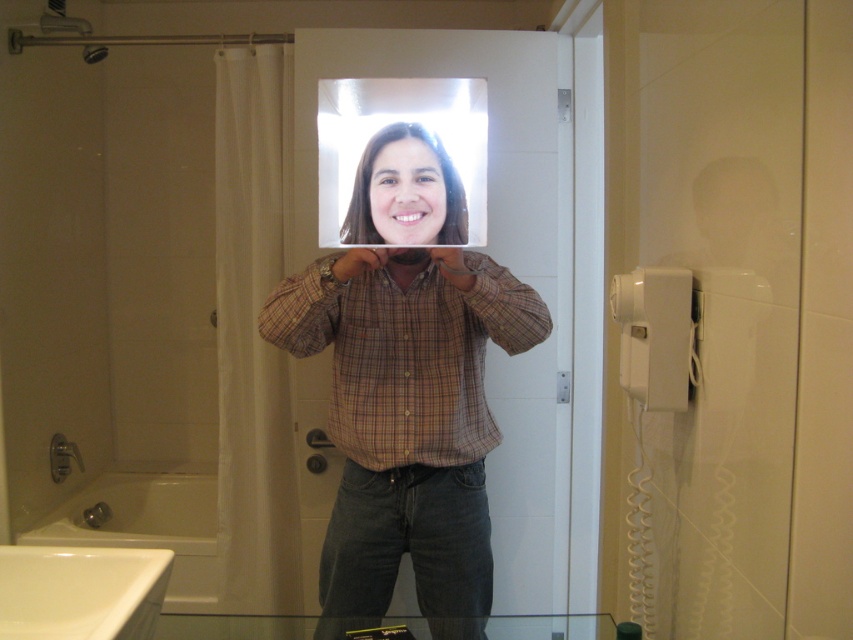
You are holding a matte plastic tablet at center and a clear plastic mirror at center in your hands. You want to place them on a shelf that is 30 centimeters wide. Can both items fit side by side on the shelf without overlapping?

The distance between the matte plastic tablet at center and the clear plastic mirror at center is 22.17 centimeters. Since the shelf is 30 centimeters wide, which is wider than the combined width of both items, they can fit side by side without overlapping.

You are trying to decide which item to place on a small shelf that can only hold items up to the size of the clear plastic mirror at center. Can you place the matte plastic tablet at center on the shelf?

The matte plastic tablet at center is larger in size than the clear plastic mirror at center. Therefore, the matte plastic tablet at center cannot be placed on the shelf since it exceeds the size limit.

You are trying to read a message on the matte plastic tablet at center while holding the clear plastic mirror at center in front of your face. Can you see the tablet clearly through the mirror?

The matte plastic tablet at center is closer to the viewer than the clear plastic tablet at center, so the mirror might not reflect the tablet clearly due to its proximity.